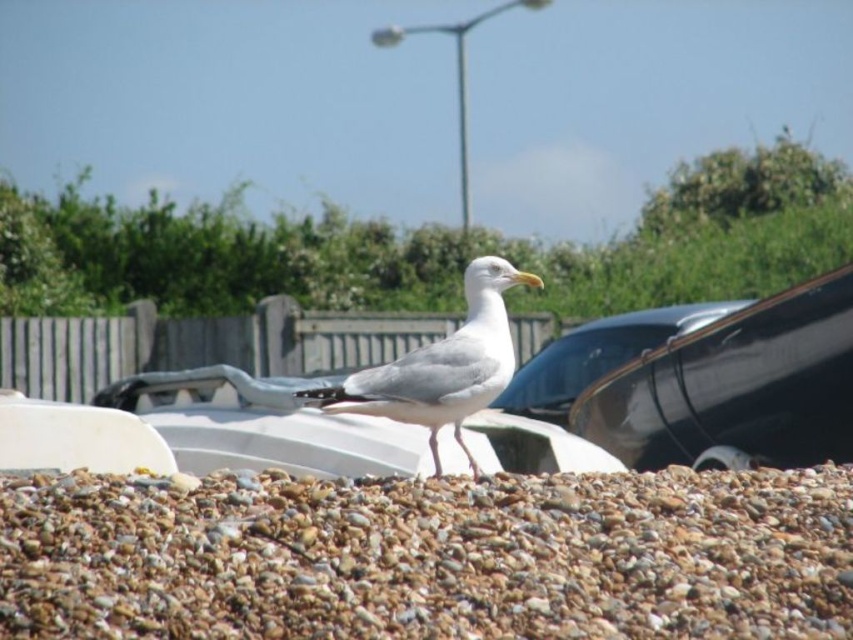
Question: Is brown pebbles at center thinner than white matte seagull at center?

Choices:
 (A) yes
 (B) no

Answer: (B)

Question: Which of the following is the farthest from the observer?

Choices:
 (A) (339, 387)
 (B) (664, 317)
 (C) (244, 612)

Answer: (B)

Question: Estimate the real-world distances between objects in this image. Which object is closer to the brown pebbles at center?

Choices:
 (A) white matte seagull at center
 (B) glossy black car at center

Answer: (A)

Question: Which is farther from the brown pebbles at center?

Choices:
 (A) white matte seagull at center
 (B) glossy black car at center

Answer: (B)

Question: Does brown pebbles at center have a lesser width compared to white matte seagull at center?

Choices:
 (A) no
 (B) yes

Answer: (A)

Question: Where is brown pebbles at center located in relation to glossy black car at center in the image?

Choices:
 (A) right
 (B) left

Answer: (B)